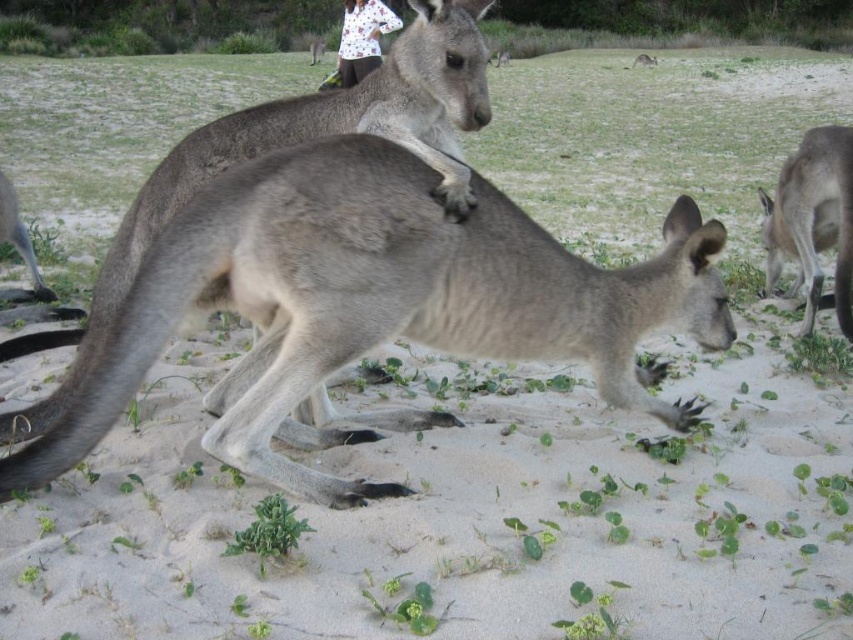
Question: Estimate the real-world distances between objects in this image. Which object is farther from the gray fur kangaroo at lower left?

Choices:
 (A) gray fur kangaroo at center
 (B) gray fur kangaroo at right
 (C) white printed shirt at upper center

Answer: (C)

Question: Can you confirm if white printed shirt at upper center is positioned above gray fur kangaroo at lower left?

Choices:
 (A) no
 (B) yes

Answer: (B)

Question: Is gray fur kangaroo at center bigger than white printed shirt at upper center?

Choices:
 (A) no
 (B) yes

Answer: (A)

Question: Which point is closer to the camera?

Choices:
 (A) gray fur kangaroo at center
 (B) white printed shirt at upper center
 (C) gray fur kangaroo at right

Answer: (A)

Question: Which is farther from the white printed shirt at upper center?

Choices:
 (A) gray fur kangaroo at center
 (B) gray fur kangaroo at lower left
 (C) gray fur kangaroo at right

Answer: (A)

Question: Can you confirm if gray fur kangaroo at center is wider than gray fur kangaroo at right?

Choices:
 (A) no
 (B) yes

Answer: (B)